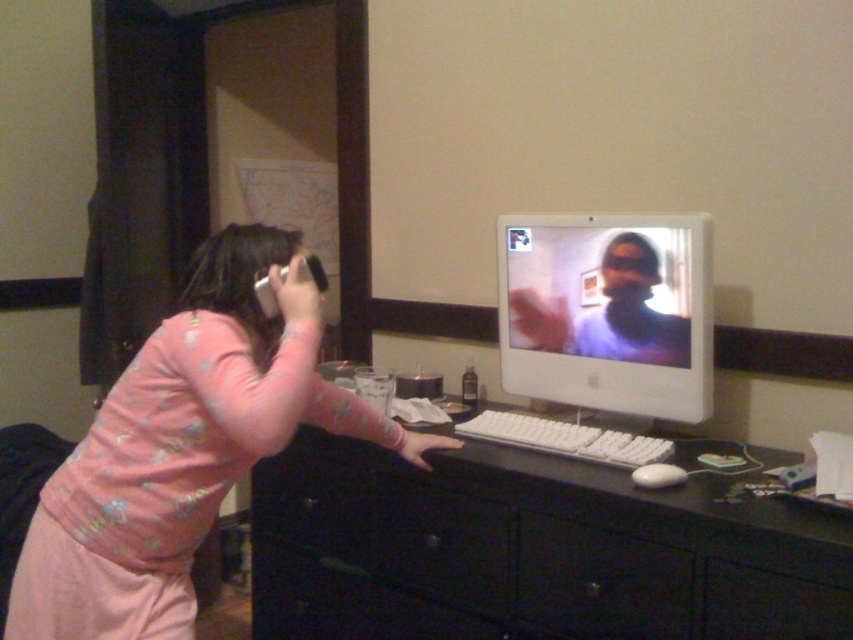
Question: From the image, what is the correct spatial relationship of black glossy computer desk at center in relation to pink fabric at left?

Choices:
 (A) below
 (B) above

Answer: (A)

Question: Can you confirm if black glossy computer desk at center is thinner than white glossy monitor at center?

Choices:
 (A) no
 (B) yes

Answer: (A)

Question: Which of the following is the closest to the observer?

Choices:
 (A) (117, 576)
 (B) (340, 451)
 (C) (611, 454)

Answer: (A)

Question: Is white glossy monitor at center wider than black plastic drawer at lower center?

Choices:
 (A) no
 (B) yes

Answer: (B)

Question: Which of the following is the closest to the observer?

Choices:
 (A) (395, 445)
 (B) (624, 532)
 (C) (457, 422)

Answer: (B)

Question: Which of the following is the farthest from the observer?

Choices:
 (A) white plastic keyboard at center
 (B) black plastic drawer at lower center

Answer: (A)